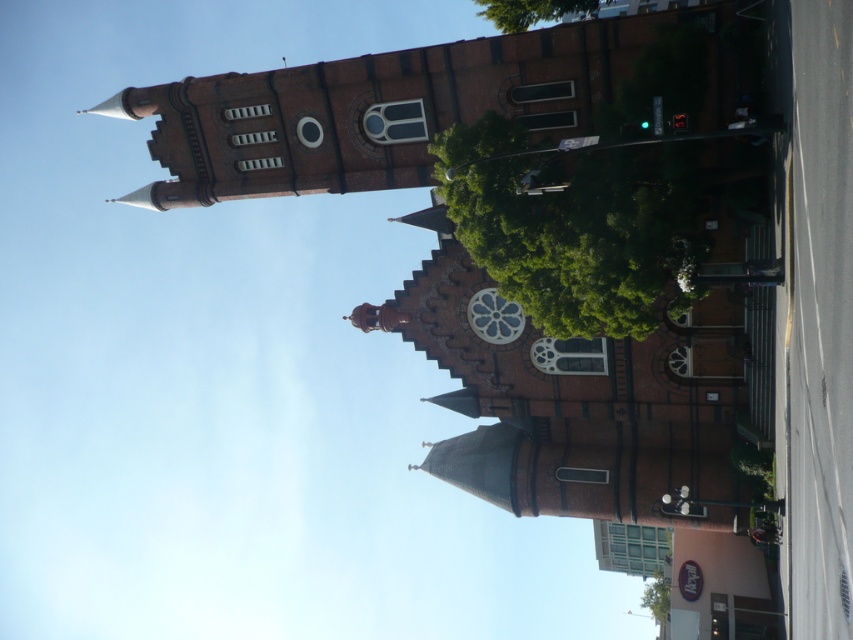
Based on the photo, does green leafy tree at center have a greater width compared to green leafy tree at lower right?

Correct, the width of green leafy tree at center exceeds that of green leafy tree at lower right.

Who is higher up, green leafy tree at center or green leafy tree at lower right?

green leafy tree at center

Locate an element on the screen. green leafy tree at center is located at coordinates (578, 227).

Find the location of a particular element. green leafy tree at center is located at coordinates 578,227.

Is brick bell tower at upper left positioned in front of green leafy tree at lower right?

Yes, brick bell tower at upper left is closer to the viewer.

Is point (343, 177) farther from camera compared to point (651, 598)?

No.

The height and width of the screenshot is (640, 853). I want to click on brick bell tower at upper left, so click(x=399, y=106).

Does brick bell tower at upper left appear under matte glass clock at center?

No.

Which is more to the left, brick bell tower at upper left or matte glass clock at center?

brick bell tower at upper left

Is point (363, 81) behind point (479, 292)?

No, (363, 81) is closer to viewer.

Locate an element on the screen. brick bell tower at upper left is located at coordinates (399, 106).